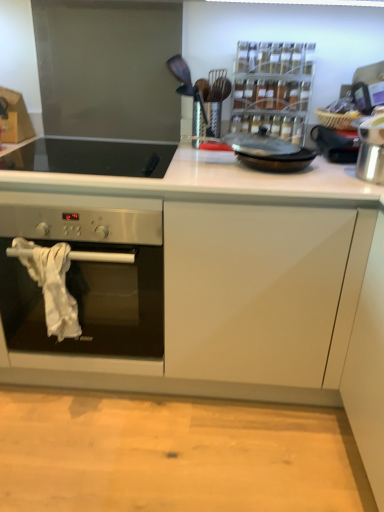
Locate an element on the screen. The image size is (384, 512). blank space situated above clear plastic spice rack at upper center, which is counted as the 2th appliance, starting from the left (from a real-world perspective) is located at coordinates (271, 33).